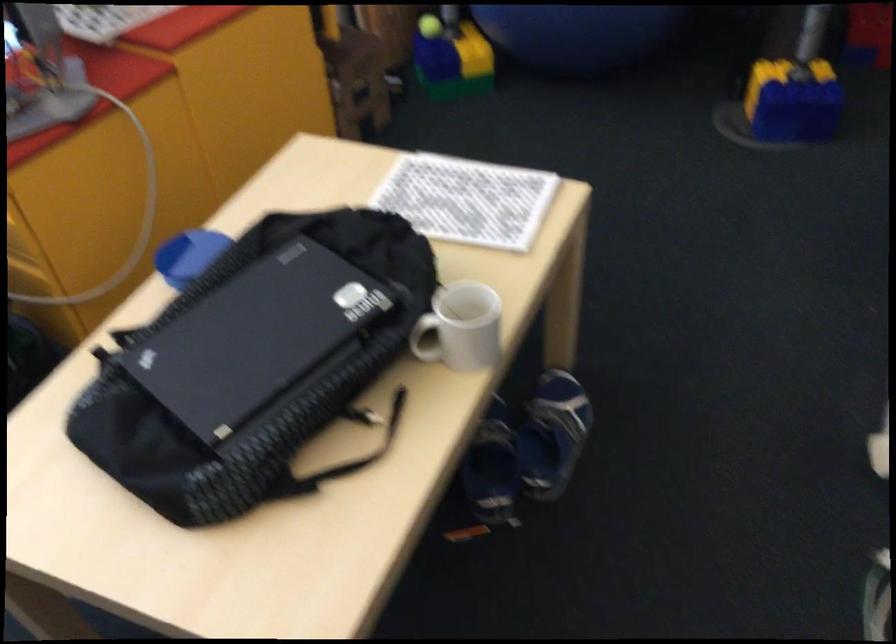
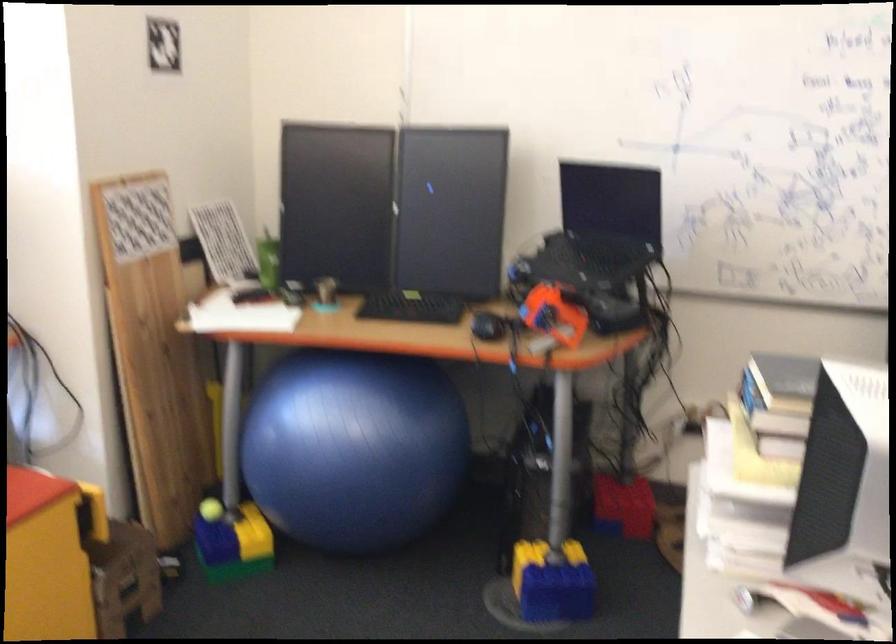
Locate, in the second image, the point that corresponds to point (794, 99) in the first image.

(552, 583)